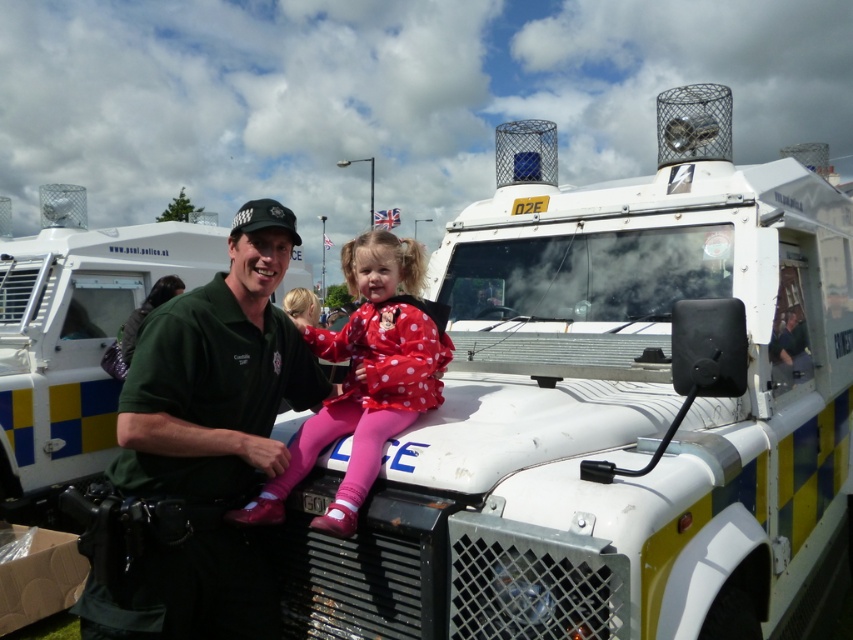
Question: Does white matte police vehicle at center appear over green fabric jacket at left?

Choices:
 (A) no
 (B) yes

Answer: (A)

Question: Where is green uniform at center located in relation to polka dot fabric dress at center in the image?

Choices:
 (A) left
 (B) right

Answer: (A)

Question: Which of the following is the closest to the observer?

Choices:
 (A) green fabric jacket at left
 (B) white matte police vehicle at center
 (C) green uniform at center

Answer: (B)

Question: Which of the following is the closest to the observer?

Choices:
 (A) white matte police vehicle at center
 (B) green uniform at center
 (C) polka dot fabric dress at center
 (D) green fabric jacket at left

Answer: (A)

Question: Does white matte police vehicle at center appear on the left side of green fabric jacket at left?

Choices:
 (A) yes
 (B) no

Answer: (B)

Question: Which object appears farthest from the camera in this image?

Choices:
 (A) green uniform at center
 (B) white matte police vehicle at center

Answer: (A)